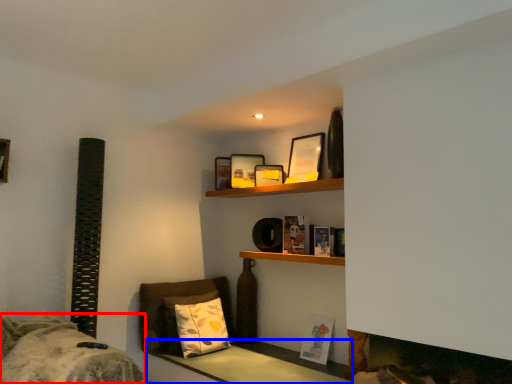
Question: Which object is closer to the camera taking this photo, bed (highlighted by a red box) or table (highlighted by a blue box)?

Choices:
 (A) bed
 (B) table

Answer: (A)